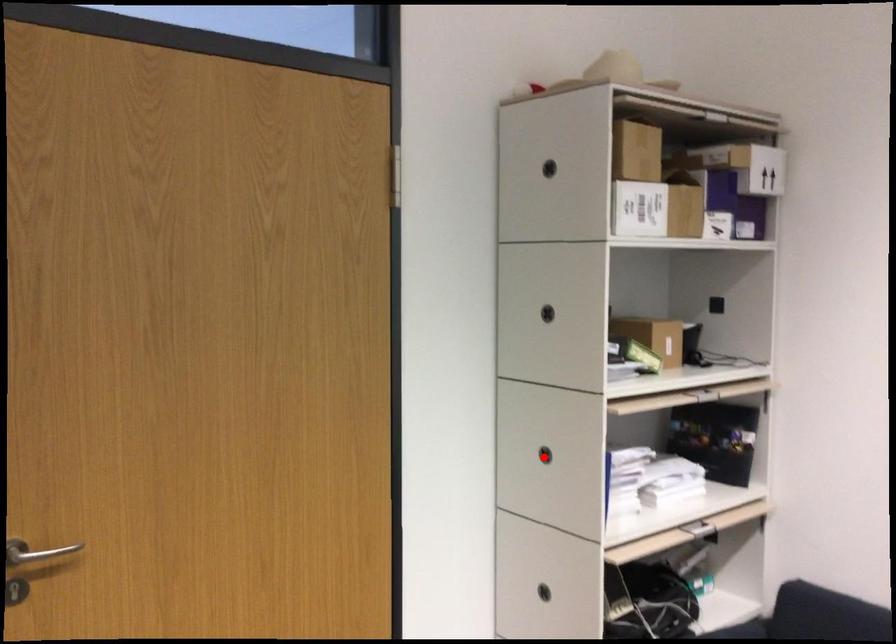
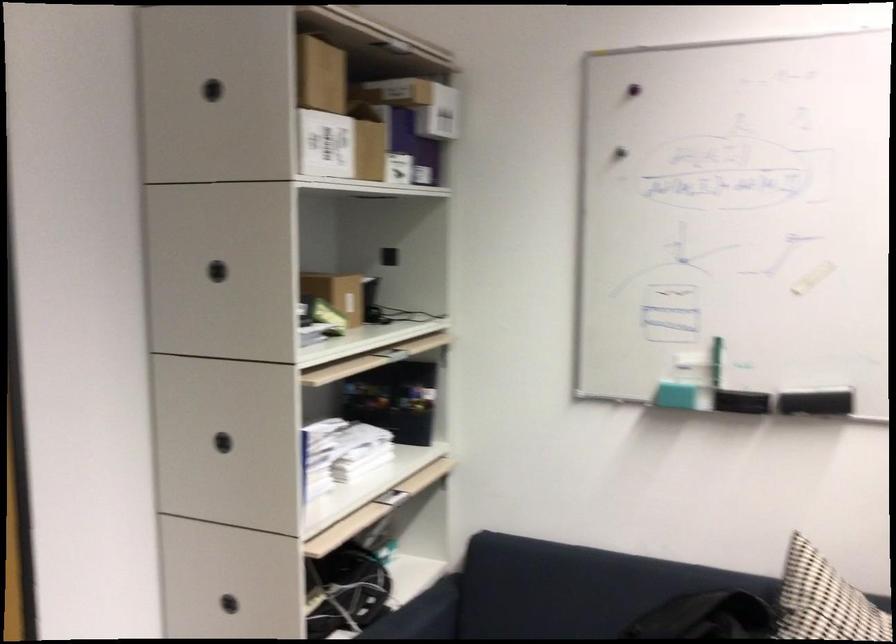
Question: I am providing you with two images of the same scene from different viewpoints. In image1, a red point is highlighted. Considering the same 3D point in image2, which of the following is correct?

Choices:
 (A) It is closer
 (B) It is farther

Answer: (A)